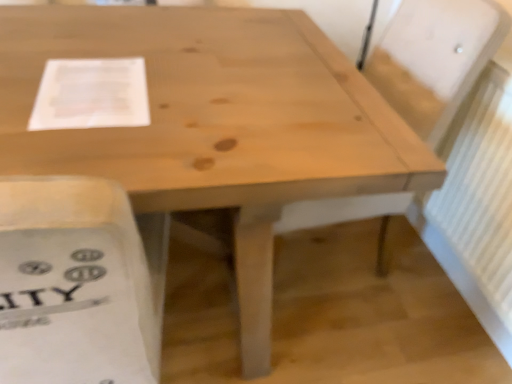
Question: Considering the relative sizes of white textured radiator at right and white paper at upper left in the image provided, is white textured radiator at right shorter than white paper at upper left?

Choices:
 (A) no
 (B) yes

Answer: (A)

Question: Is white textured radiator at right next to white paper at upper left and touching it?

Choices:
 (A) no
 (B) yes

Answer: (A)

Question: Does white textured radiator at right have a larger size compared to white paper at upper left?

Choices:
 (A) no
 (B) yes

Answer: (B)

Question: Can you confirm if white textured radiator at right is positioned to the left of white paper at upper left?

Choices:
 (A) yes
 (B) no

Answer: (B)

Question: Is white textured radiator at right wider than white paper at upper left?

Choices:
 (A) no
 (B) yes

Answer: (A)

Question: Considering the relative sizes of white textured radiator at right and white paper at upper left in the image provided, is white textured radiator at right thinner than white paper at upper left?

Choices:
 (A) no
 (B) yes

Answer: (B)

Question: Can you confirm if white paper at upper left is shorter than white textured radiator at right?

Choices:
 (A) yes
 (B) no

Answer: (A)

Question: Are white paper at upper left and white textured radiator at right far apart?

Choices:
 (A) no
 (B) yes

Answer: (B)

Question: Is white paper at upper left facing away from white textured radiator at right?

Choices:
 (A) no
 (B) yes

Answer: (A)

Question: From a real-world perspective, does white paper at upper left stand above white textured radiator at right?

Choices:
 (A) yes
 (B) no

Answer: (A)

Question: Is white paper at upper left taller than white textured radiator at right?

Choices:
 (A) yes
 (B) no

Answer: (B)

Question: Considering the relative sizes of white paper at upper left and white textured radiator at right in the image provided, is white paper at upper left bigger than white textured radiator at right?

Choices:
 (A) no
 (B) yes

Answer: (A)

Question: Is point (141, 64) positioned closer to the camera than point (501, 177)?

Choices:
 (A) closer
 (B) farther

Answer: (A)